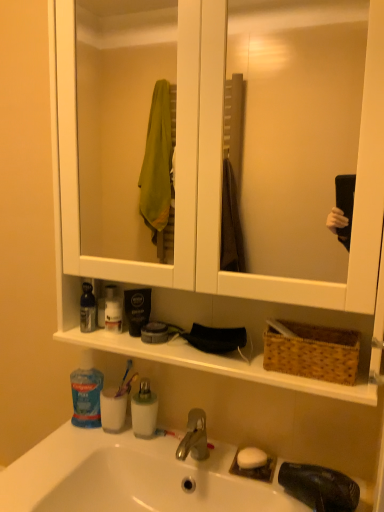
Question: Would you say white plastic toothbrush at center, positioned as the first toothbrush in front-to-back order, contains blue translucent mouthwash at lower left, arranged as the 2th mouthwash when viewed from the right?

Choices:
 (A) yes
 (B) no

Answer: (B)

Question: Is white plastic toothbrush at center, positioned as the first toothbrush in front-to-back order, far away from blue translucent mouthwash at lower left, the first mouthwash positioned from the left?

Choices:
 (A) no
 (B) yes

Answer: (A)

Question: Can you confirm if white plastic toothbrush at center, the first toothbrush viewed from the right, is smaller than blue translucent mouthwash at lower left, the first mouthwash positioned from the left?

Choices:
 (A) no
 (B) yes

Answer: (B)

Question: Does white plastic toothbrush at center, the 2th toothbrush viewed from the left, appear on the right side of blue translucent mouthwash at lower left, the first mouthwash positioned from the left?

Choices:
 (A) no
 (B) yes

Answer: (B)

Question: Does white plastic toothbrush at center, the 2th toothbrush viewed from the left, appear on the left side of blue translucent mouthwash at lower left, the first mouthwash positioned from the left?

Choices:
 (A) no
 (B) yes

Answer: (A)

Question: From the image's perspective, is blue plastic toothpaste at lower left, the 2th toiletry positioned from the top, above or below white opaque bottle at center, marked as the 2th mouthwash in a left-to-right arrangement?

Choices:
 (A) below
 (B) above

Answer: (B)

Question: Considering their positions, is blue plastic toothpaste at lower left, the 2th toiletry positioned from the top, located in front of or behind white opaque bottle at center, marked as the 2th mouthwash in a left-to-right arrangement?

Choices:
 (A) front
 (B) behind

Answer: (B)

Question: Based on their sizes in the image, would you say blue plastic toothpaste at lower left, the 2th toiletry positioned from the top, is bigger or smaller than white opaque bottle at center, marked as the 2th mouthwash in a left-to-right arrangement?

Choices:
 (A) big
 (B) small

Answer: (A)

Question: Choose the correct answer: Is blue plastic toothpaste at lower left, the 2th toiletry positioned from the top, inside white opaque bottle at center, which is the first mouthwash in right-to-left order, or outside it?

Choices:
 (A) inside
 (B) outside

Answer: (B)

Question: From a real-world perspective, relative to white matte soap at sink, is white plastic toothbrush at center, the 2th toothbrush when ordered from top to bottom, vertically above or below?

Choices:
 (A) below
 (B) above

Answer: (A)

Question: Considering the positions of white plastic toothbrush at center, positioned as the first toothbrush in front-to-back order, and white matte soap at sink in the image, is white plastic toothbrush at center, positioned as the first toothbrush in front-to-back order, wider or thinner than white matte soap at sink?

Choices:
 (A) wide
 (B) thin

Answer: (B)

Question: Does point (162, 429) appear closer or farther from the camera than point (241, 448)?

Choices:
 (A) farther
 (B) closer

Answer: (A)

Question: Considering the positions of white plastic toothbrush at center, the second toothbrush when ordered from back to front, and white matte soap at sink in the image, is white plastic toothbrush at center, the second toothbrush when ordered from back to front, bigger or smaller than white matte soap at sink?

Choices:
 (A) small
 (B) big

Answer: (A)

Question: Is point (350, 345) closer or farther from the camera than point (263, 455)?

Choices:
 (A) closer
 (B) farther

Answer: (A)

Question: Considering the positions of brown woven basket at right and white matte soap at sink in the image, is brown woven basket at right wider or thinner than white matte soap at sink?

Choices:
 (A) wide
 (B) thin

Answer: (A)